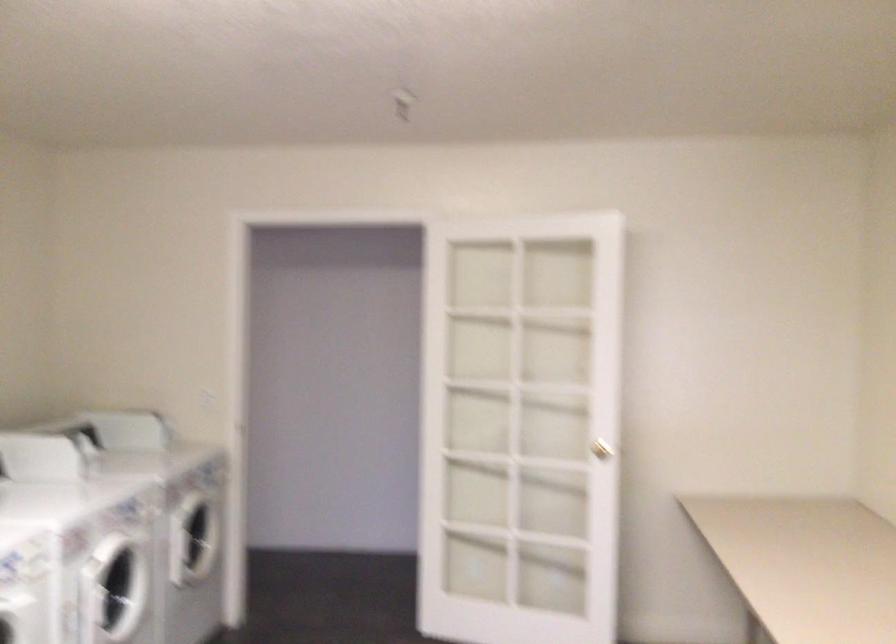
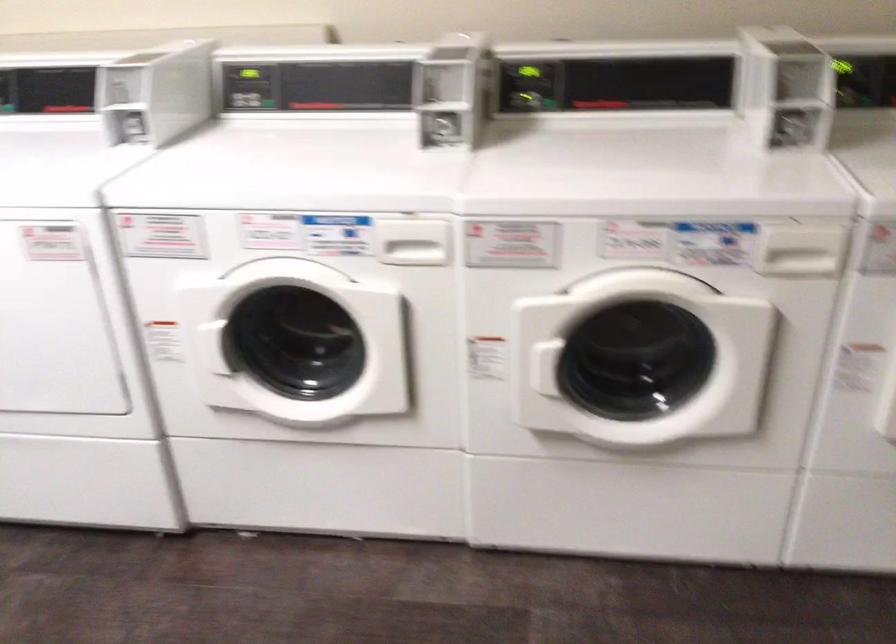
The point at (91, 466) is marked in the first image. Where is the corresponding point in the second image?

(798, 129)